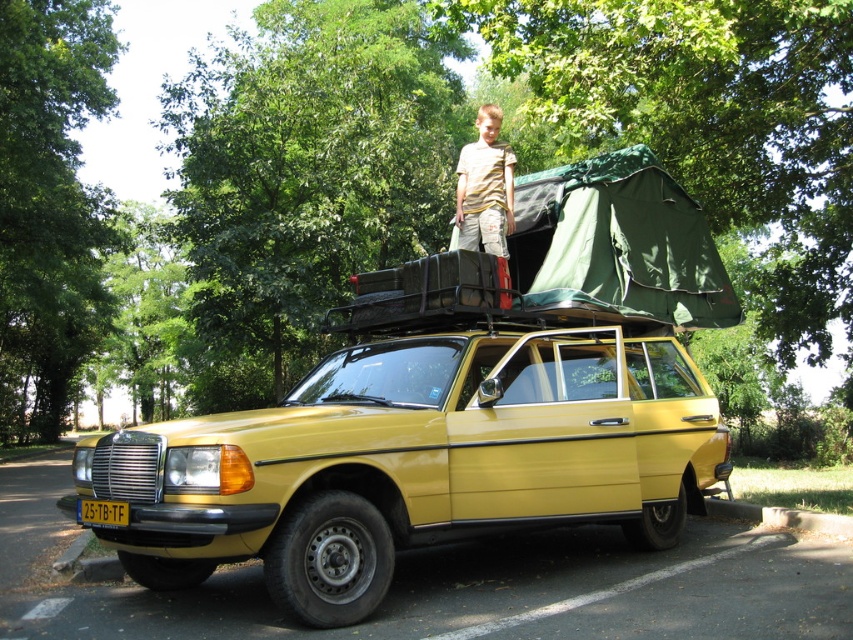
You are a photographer trying to capture a clear photo of the yellow matte car at center and the yellow striped shirt at upper center. Since both are yellow, you want to ensure they are distinguishable in the photo. Which object should you focus on first to ensure clarity, considering their sizes?

The yellow matte car at center is taller than the yellow striped shirt at upper center, so focusing on the car first will ensure clarity due to its larger size.